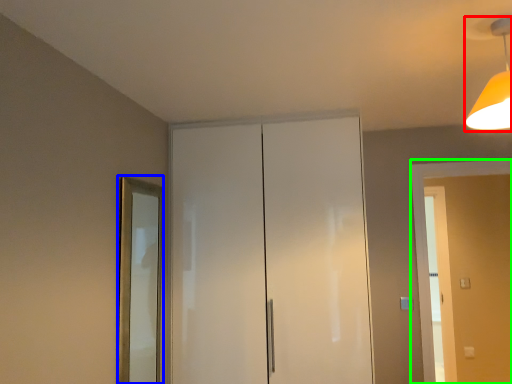
Question: Which is farther away from light fixture (highlighted by a red box)? mirror (highlighted by a blue box) or screen door (highlighted by a green box)?

Choices:
 (A) mirror
 (B) screen door

Answer: (A)